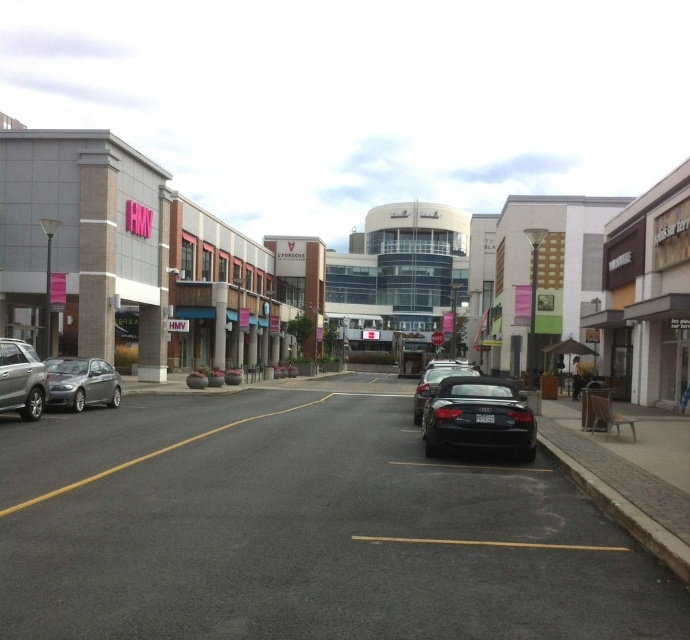
Question: Does satin silver sedan at left come behind silver metallic sedan at left?

Choices:
 (A) no
 (B) yes

Answer: (B)

Question: Which object is farther from the camera taking this photo?

Choices:
 (A) black matte car at center
 (B) matte gray building at center
 (C) silver metallic sedan at left
 (D) satin silver sedan at left

Answer: (B)

Question: Which of the following is the farthest from the observer?

Choices:
 (A) silver metallic sedan at left
 (B) satin silver sedan at left
 (C) black matte car at center

Answer: (B)

Question: Among these objects, which one is nearest to the camera?

Choices:
 (A) silver metallic sedan at left
 (B) satin silver sedan at left
 (C) matte gray building at center
 (D) black matte car at center

Answer: (A)

Question: Is black matte convertible at center positioned in front of satin silver sedan at left?

Choices:
 (A) no
 (B) yes

Answer: (B)

Question: Can you confirm if satin silver sedan at left is positioned above black matte car at center?

Choices:
 (A) no
 (B) yes

Answer: (B)